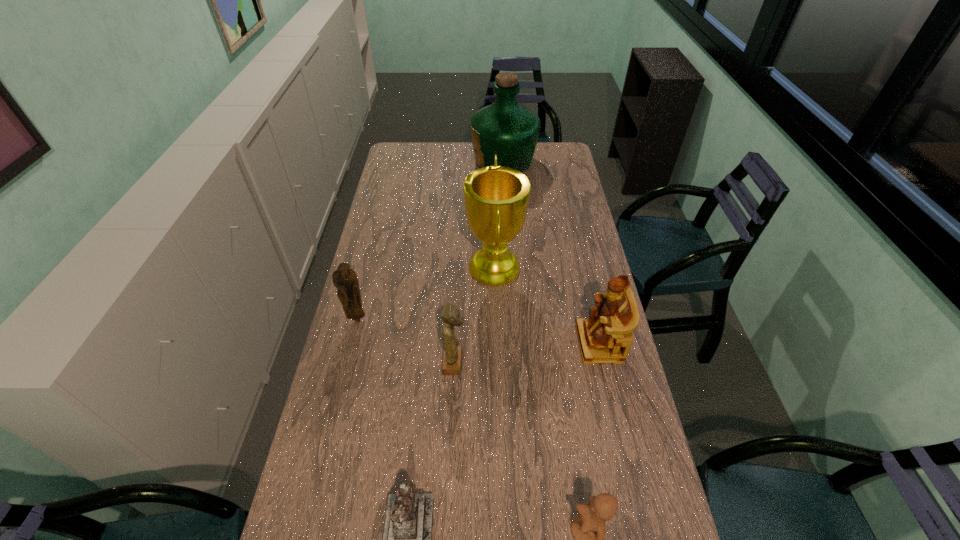
At what (x,y) coordinates should I click in order to perform the action: click on vacant space situated on the shiny surface of the award. Please return your answer as a coordinate pair (x, y). This screenshot has width=960, height=540. Looking at the image, I should click on (407, 268).

Where is `free point located on the front-facing side of the rightmost object`? The width and height of the screenshot is (960, 540). free point located on the front-facing side of the rightmost object is located at coordinates [x=532, y=343].

Find the location of a particular element. This screenshot has height=540, width=960. vacant space located on the front-facing side of the rightmost object is located at coordinates (554, 343).

I want to click on free space located on the front-facing side of the rightmost object, so point(557,343).

Locate an element on the screen. vacant position located on the front-facing side of the third farthest object is located at coordinates [337, 403].

You are a GUI agent. You are given a task and a screenshot of the screen. Output one action in this format:
    pyautogui.click(x=<x>, y=<y>)
    Task: Click on the object at the far edge
    The width and height of the screenshot is (960, 540).
    Given the screenshot: What is the action you would take?
    pyautogui.click(x=505, y=128)

Find the location of a particular element. The height and width of the screenshot is (540, 960). object that is positioned at the left edge is located at coordinates 345,279.

Where is `liquor that is positioned at the right edge`? liquor that is positioned at the right edge is located at coordinates coord(505,128).

Locate an element on the screen. The width and height of the screenshot is (960, 540). figurine positioned at the right edge is located at coordinates point(606,336).

The width and height of the screenshot is (960, 540). What are the coordinates of `object that is at the far right corner` in the screenshot? It's located at (505, 128).